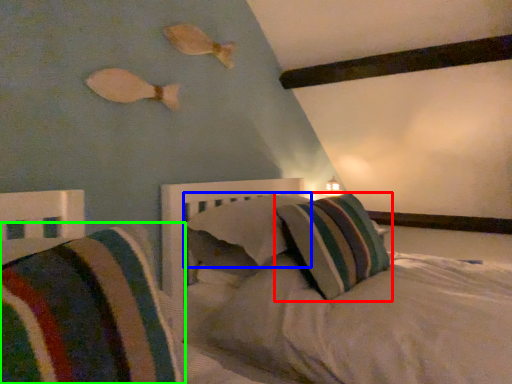
Question: Estimate the real-world distances between objects in this image. Which object is closer to pillow (highlighted by a red box), pillow (highlighted by a blue box) or pillow (highlighted by a green box)?

Choices:
 (A) pillow
 (B) pillow

Answer: (A)